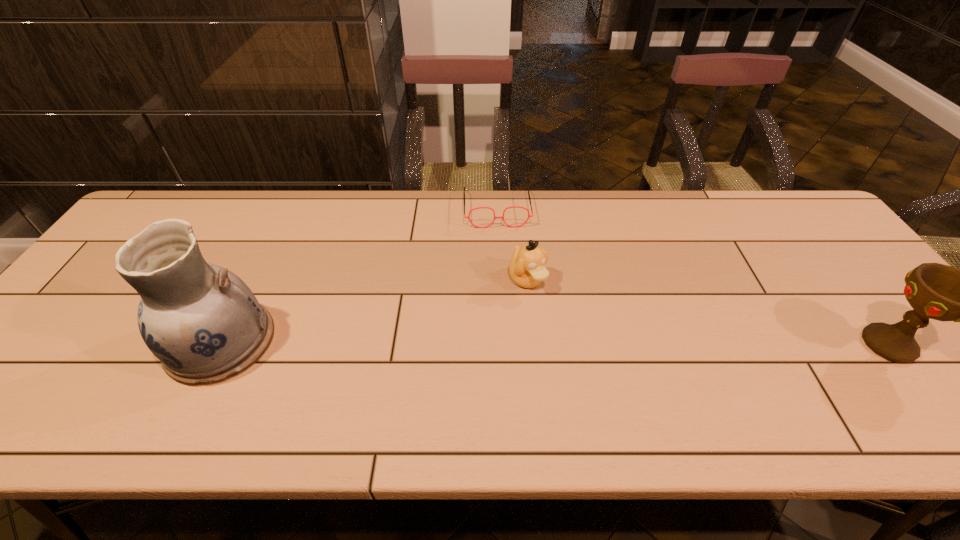
Identify the location of unoccupied position between the third shortest object and the tallest object. The width and height of the screenshot is (960, 540). (555, 343).

The height and width of the screenshot is (540, 960). Identify the location of free space between the pottery and the duckling. (374, 311).

At what (x,y) coordinates should I click in order to perform the action: click on free space between the leftmost object and the farthest object. Please return your answer as a coordinate pair (x, y). The width and height of the screenshot is (960, 540). Looking at the image, I should click on (359, 275).

Where is `vacant region between the third tallest object and the farthest object`? The height and width of the screenshot is (540, 960). vacant region between the third tallest object and the farthest object is located at coordinates (512, 244).

I want to click on free point between the spectacles and the chalice, so click(692, 276).

Where is `free space between the third tallest object and the farthest object`? This screenshot has height=540, width=960. free space between the third tallest object and the farthest object is located at coordinates (512, 244).

Image resolution: width=960 pixels, height=540 pixels. Find the location of `vacant region between the leftmost object and the shortest object`. vacant region between the leftmost object and the shortest object is located at coordinates (359, 275).

Identify the location of vacant region between the rightmost object and the pottery. Image resolution: width=960 pixels, height=540 pixels. (555, 343).

The width and height of the screenshot is (960, 540). I want to click on vacant space that is in between the third shortest object and the duckling, so click(x=708, y=313).

Locate an element on the screen. The image size is (960, 540). object identified as the closest to the farthest object is located at coordinates (x=527, y=269).